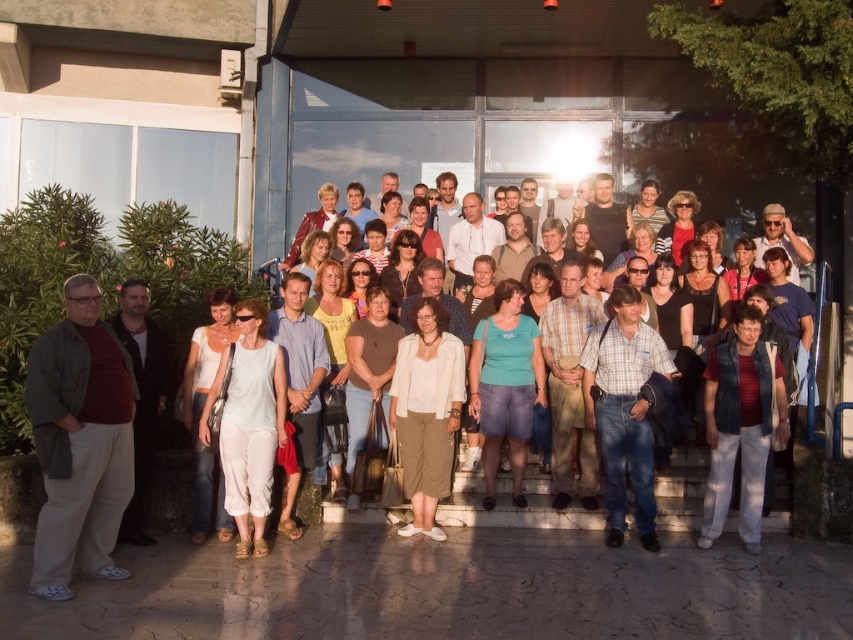
Question: Does plaid shirt at center appear on the right side of matte green shirt at center?

Choices:
 (A) no
 (B) yes

Answer: (B)

Question: Among these points, which one is nearest to the camera?

Choices:
 (A) (445, 492)
 (B) (585, 410)

Answer: (A)

Question: Can you confirm if white matte jacket at center is wider than matte red shirt at left?

Choices:
 (A) no
 (B) yes

Answer: (B)

Question: Does light blue fabric dress at center lie behind matte red shirt at left?

Choices:
 (A) yes
 (B) no

Answer: (B)

Question: Based on their relative distances, which object is nearer to the denim vest at lower right?

Choices:
 (A) matte red shirt at left
 (B) plaid shirt at center
 (C) matte gray jacket at left
 (D) matte green shirt at center

Answer: (B)

Question: Based on their relative distances, which object is nearer to the matte gray jacket at left?

Choices:
 (A) white matte jacket at center
 (B) light blue fabric dress at center
 (C) matte green shirt at center

Answer: (B)